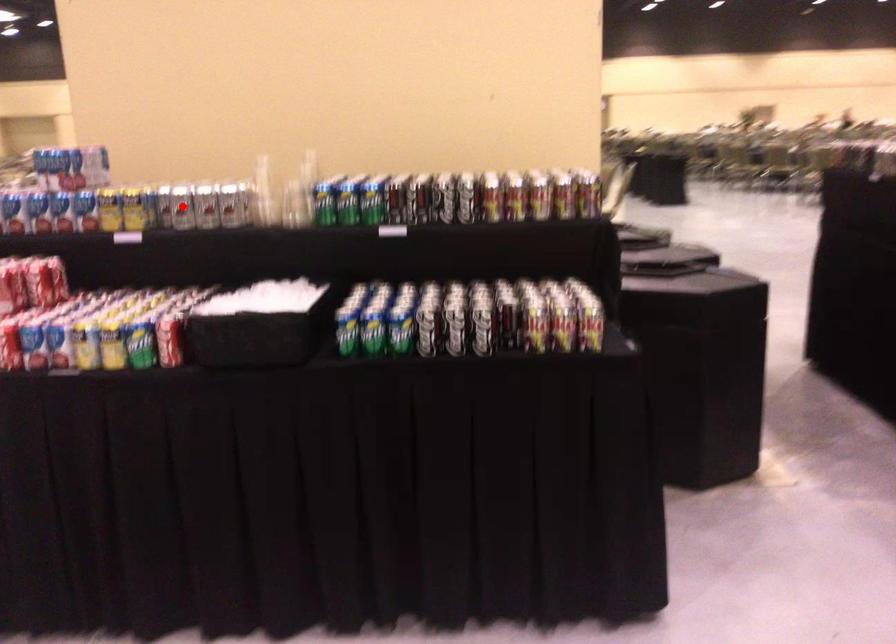
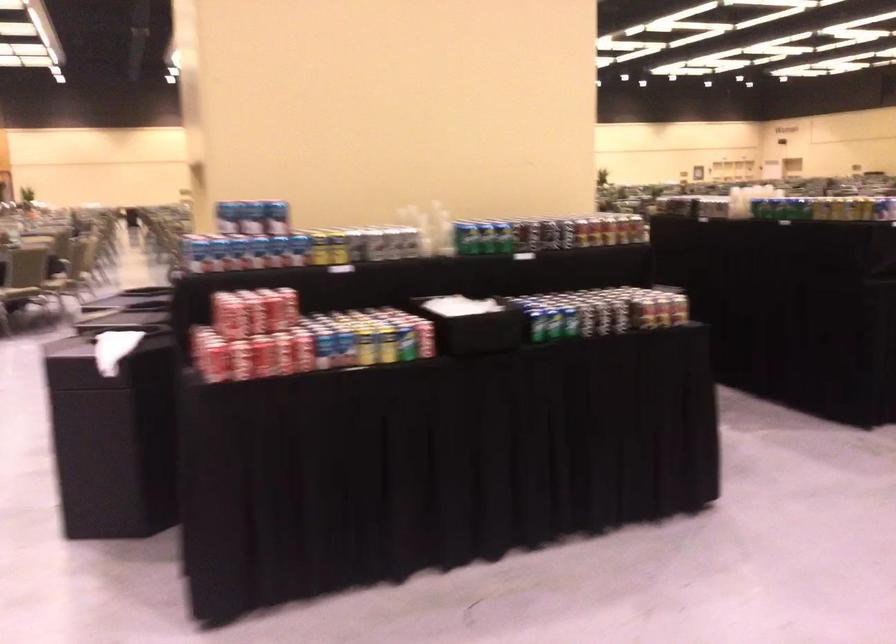
In the second image, find the point that corresponds to the highlighted location in the first image.

(375, 243)